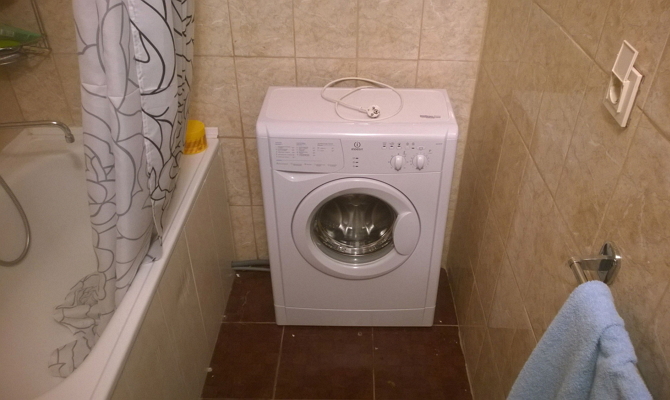
Identify the location of washer knobs. (395, 161), (425, 160).